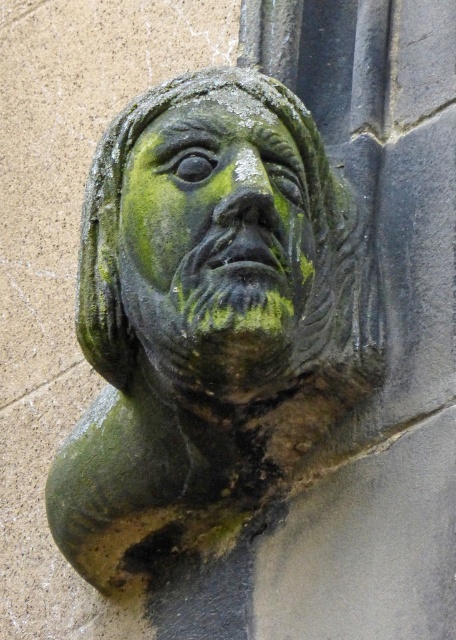
You are standing in front of a stone wall with a sculpture. There is a point at coordinates (208, 321). What is located at that point?

The green stone bust at center is located at point (208, 321).

You are an art conservator examining the weathered stone sculpture. You notice two parts of the sculpture labeled as the green stone bust at center and the green stone face at center. Based on their positions, which one is located to the left?

The green stone bust at center is to the left of the green stone face at center, so the green stone bust at center is located to the left.

You are an art conservator examining the green stone bust at center and the green stone face at center. Which object has a greater width?

The green stone bust at center has a greater width than the green stone face at center.